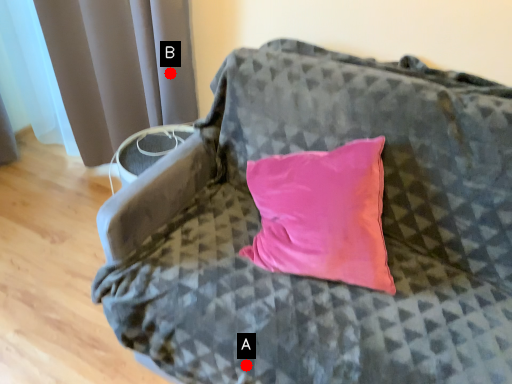
Question: Two points are circled on the image, labeled by A and B beside each circle. Which point appears farthest from the camera in this image?

Choices:
 (A) A is further
 (B) B is further

Answer: (B)